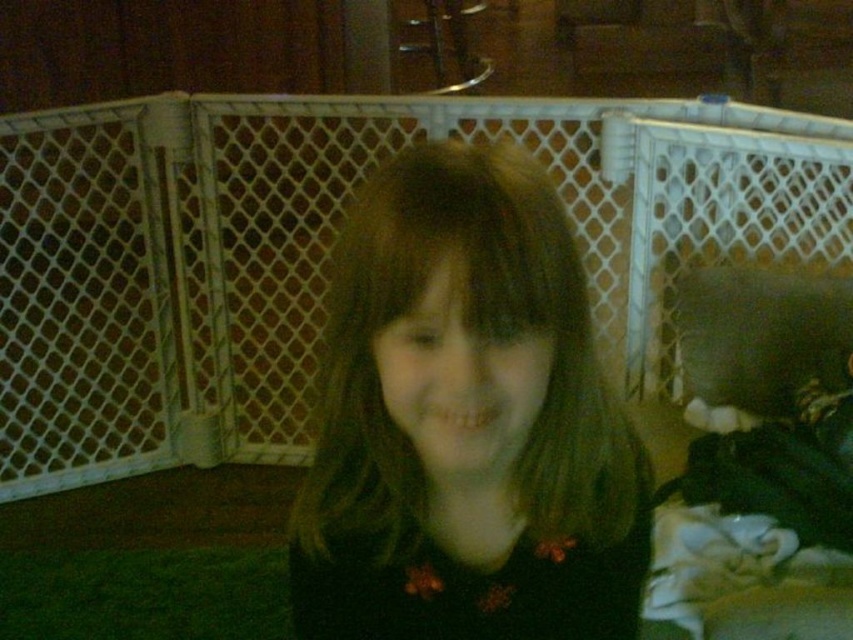
Is dark fabric couch at right below dark gray fabric pillow at right?

Yes, dark fabric couch at right is below dark gray fabric pillow at right.

Between point (711, 595) and point (750, 282), which one is positioned in front?

Point (711, 595) is more forward.

Between point (820, 589) and point (807, 332), which one is positioned behind?

Point (807, 332)

Where is `dark fabric couch at right`? Image resolution: width=853 pixels, height=640 pixels. dark fabric couch at right is located at coordinates (759, 461).

Who is shorter, dark brown hair at center or dark gray fabric pillow at right?

With less height is dark gray fabric pillow at right.

Does dark brown hair at center appear on the right side of dark gray fabric pillow at right?

Incorrect, dark brown hair at center is not on the right side of dark gray fabric pillow at right.

At what (x,y) coordinates should I click in order to perform the action: click on dark brown hair at center. Please return your answer as a coordinate pair (x, y). The height and width of the screenshot is (640, 853). Looking at the image, I should click on (466, 420).

Does point (306, 493) come behind point (776, 560)?

No.

Who is shorter, dark brown hair at center or dark fabric couch at right?

With less height is dark brown hair at center.

Where is `dark brown hair at center`? This screenshot has width=853, height=640. dark brown hair at center is located at coordinates (466, 420).